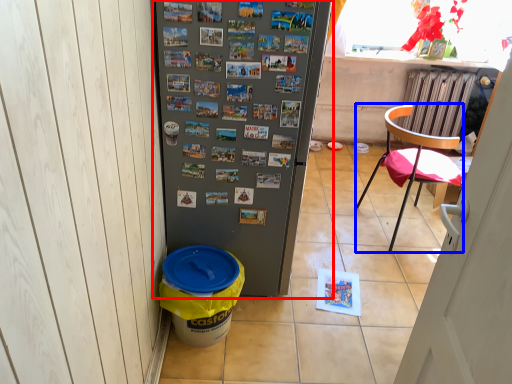
Question: Which of the following is the farthest to the observer, refrigerator (highlighted by a red box) or chair (highlighted by a blue box)?

Choices:
 (A) refrigerator
 (B) chair

Answer: (B)